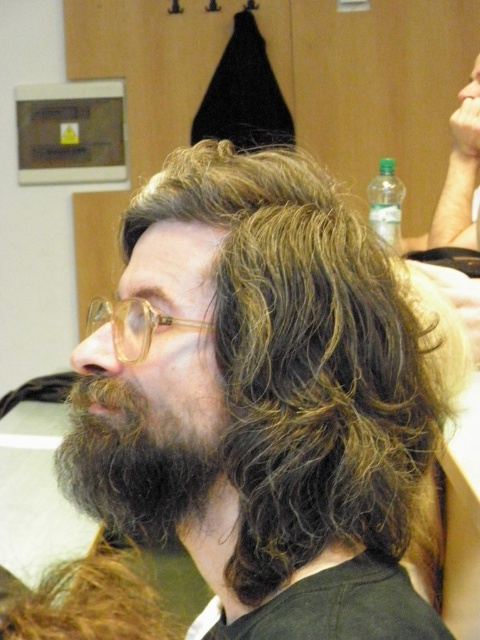
Can you confirm if translucent plastic glasses at left is positioned to the left of clear plastic bottle at upper right?

Correct, you'll find translucent plastic glasses at left to the left of clear plastic bottle at upper right.

Between point (87, 333) and point (372, 212), which one is positioned in front?

Point (372, 212)

Where is `translucent plastic glasses at left`? Image resolution: width=480 pixels, height=640 pixels. translucent plastic glasses at left is located at coordinates (133, 324).

Can you confirm if dark brown wavy hair at center is positioned below clear plastic bottle at upper right?

Indeed, dark brown wavy hair at center is positioned under clear plastic bottle at upper right.

Is dark brown wavy hair at center closer to the viewer compared to clear plastic bottle at upper right?

Yes.

Which is behind, point (323, 372) or point (391, 173)?

The point (391, 173) is more distant.

Where is `dark brown wavy hair at center`? The height and width of the screenshot is (640, 480). dark brown wavy hair at center is located at coordinates (312, 365).

Which is behind, point (296, 388) or point (80, 452)?

The point (80, 452) is behind.

Can you confirm if dark brown wavy hair at center is wider than dark brown fuzzy beard at lower left?

Yes.

Which is behind, point (355, 429) or point (162, 438)?

Positioned behind is point (162, 438).

Identify the location of dark brown wavy hair at center. The image size is (480, 640). (312, 365).